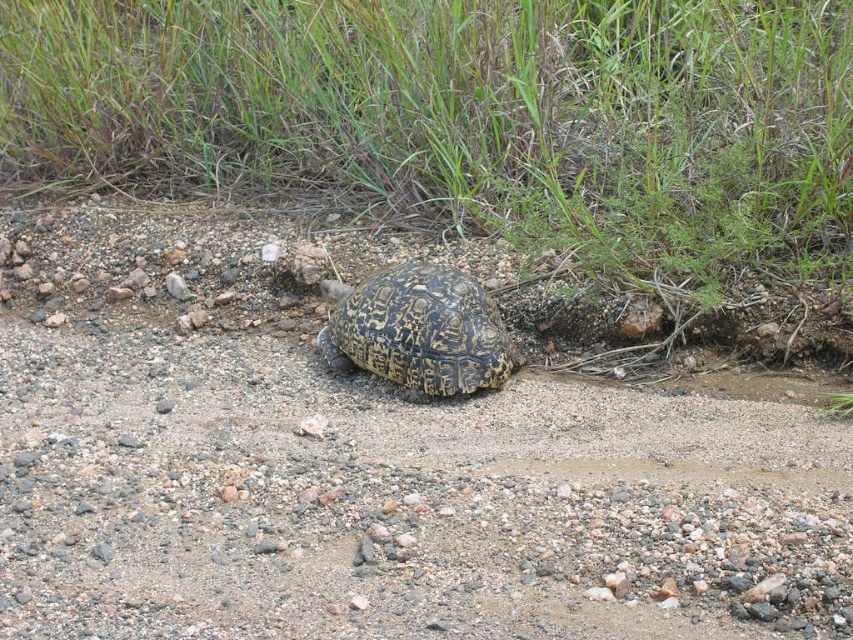
Which is below, brown gravel dirt track at center or leopard print shell at center?

brown gravel dirt track at center

Who is shorter, brown gravel dirt track at center or leopard print shell at center?

Standing shorter between the two is leopard print shell at center.

Which is behind, point (263, 467) or point (399, 301)?

The point (399, 301) is more distant.

Find the location of a particular element. This screenshot has width=853, height=640. brown gravel dirt track at center is located at coordinates (378, 461).

Between point (154, 132) and point (480, 323), which one is positioned in front?

Positioned in front is point (480, 323).

Is green grass at upper center wider than leopard print shell at center?

Yes.

Is point (326, 28) farther from camera compared to point (486, 333)?

Yes, it is.

The width and height of the screenshot is (853, 640). Identify the location of green grass at upper center. (468, 115).

Measure the distance from brown gravel dirt track at center to green grass at upper center.

brown gravel dirt track at center and green grass at upper center are 3.86 feet apart from each other.

Is brown gravel dirt track at center to the right of green grass at upper center from the viewer's perspective?

Incorrect, brown gravel dirt track at center is not on the right side of green grass at upper center.

Describe the element at coordinates (378, 461) in the screenshot. This screenshot has width=853, height=640. I see `brown gravel dirt track at center` at that location.

Find the location of a particular element. The image size is (853, 640). brown gravel dirt track at center is located at coordinates (378, 461).